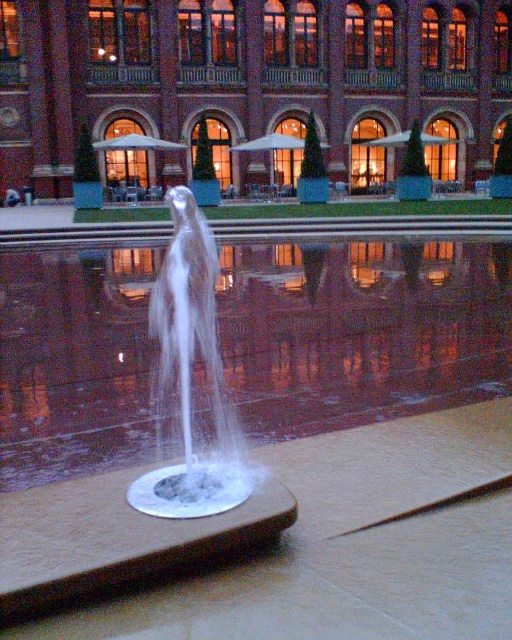
You are standing in front of the fountain and notice two points marked in the scene. The first point is at coordinates point (431, 365) and the second is at point (179, 291). Which point is closer to you as you face the fountain?

Point (431, 365) is closer to you because it is further to the viewer than point (179, 291).

Consider the image. You are standing in front of the fountain and want to know which part of the water at the center is closer to you. Can you determine which one is lower between the clear liquid water at center and the white translucent water at center?

The clear liquid water at center is located below white translucent water at center, so the white translucent water at center is lower and closer to you.

You are standing at the center of the image and want to pour a drink into the clear liquid water at center. In which direction should you move to reach it?

The clear liquid water at center is located at point (x=361, y=330), so you should move forward to reach it since it is directly in front of you.